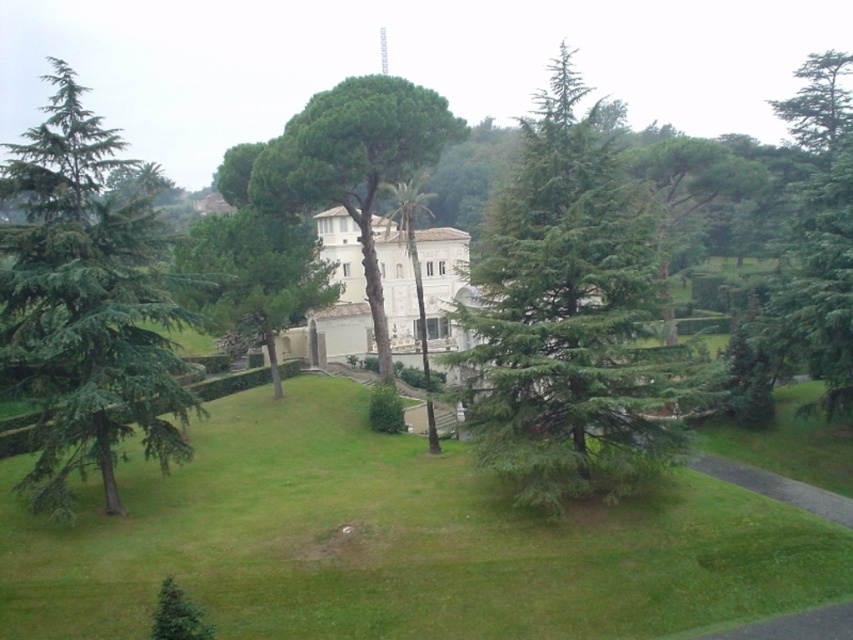
Question: Which of these objects is positioned farthest from the green grassy at center?

Choices:
 (A) green needle-like tree at left
 (B) green needle-like tree at center

Answer: (A)

Question: Is green grassy at center behind green leafy tree at center?

Choices:
 (A) no
 (B) yes

Answer: (A)

Question: From the image, what is the correct spatial relationship of green needle-like tree at left in relation to green leafy tree at center?

Choices:
 (A) below
 (B) above

Answer: (B)

Question: Can you confirm if green grassy at center is bigger than green leafy tree at center?

Choices:
 (A) yes
 (B) no

Answer: (B)

Question: Based on their relative distances, which object is nearer to the green leafy tree at center?

Choices:
 (A) green grassy at center
 (B) green needle-like tree at center
 (C) green needle-like tree at left

Answer: (B)

Question: Which point is closer to the camera?

Choices:
 (A) green grassy at center
 (B) green needle-like tree at left
 (C) green needle-like tree at center
 (D) green leafy tree at center

Answer: (A)